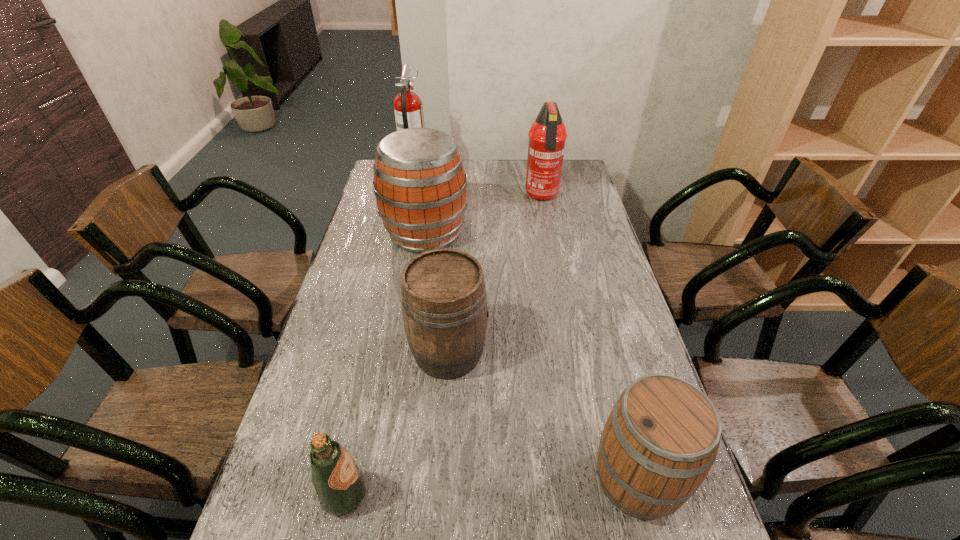
Where is `object present at the far left corner`? The image size is (960, 540). object present at the far left corner is located at coordinates (408, 108).

Where is `object located in the far right corner section of the desktop`? Image resolution: width=960 pixels, height=540 pixels. object located in the far right corner section of the desktop is located at coordinates (547, 135).

At what (x,y) coordinates should I click in order to perform the action: click on vacant space at the far edge of the desktop. Please return your answer as a coordinate pair (x, y). Image resolution: width=960 pixels, height=540 pixels. Looking at the image, I should click on (517, 178).

The image size is (960, 540). I want to click on free space at the left edge of the desktop, so click(x=280, y=532).

I want to click on vacant space at the right edge, so click(588, 244).

You are a GUI agent. You are given a task and a screenshot of the screen. Output one action in this format:
    pyautogui.click(x=<x>, y=<y>)
    Task: Click on the vacant point located between the second nearest cider and the nearest cider
    
    Given the screenshot: What is the action you would take?
    pyautogui.click(x=543, y=416)

Locate an element on the screen. The height and width of the screenshot is (540, 960). empty space that is in between the fourth farthest object and the rightmost cider is located at coordinates (543, 416).

This screenshot has width=960, height=540. What are the coordinates of `free space that is in between the third nearest object and the second farthest object` in the screenshot? It's located at (495, 274).

Find the location of a particular element. This screenshot has height=540, width=960. vacant space that is in between the right fire extinguisher and the nearest cider is located at coordinates (589, 338).

Locate an element on the screen. The height and width of the screenshot is (540, 960). vacant space that is in between the nearest cider and the farthest cider is located at coordinates (532, 356).